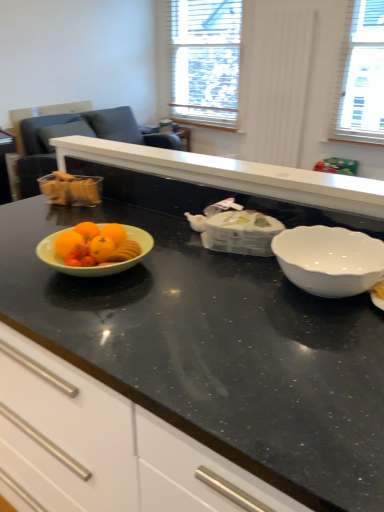
Question: From a real-world perspective, is translucent plastic container at left positioned under black granite countertop at center based on gravity?

Choices:
 (A) yes
 (B) no

Answer: (B)

Question: Can you confirm if translucent plastic container at left is wider than black granite countertop at center?

Choices:
 (A) yes
 (B) no

Answer: (B)

Question: Could you tell me if translucent plastic container at left is facing black granite countertop at center?

Choices:
 (A) no
 (B) yes

Answer: (B)

Question: Does translucent plastic container at left appear on the left side of black granite countertop at center?

Choices:
 (A) yes
 (B) no

Answer: (A)

Question: Are translucent plastic container at left and black granite countertop at center located far from each other?

Choices:
 (A) yes
 (B) no

Answer: (B)

Question: From the image's perspective, is translucent plastic container at left located beneath black granite countertop at center?

Choices:
 (A) yes
 (B) no

Answer: (B)

Question: Considering the relative sizes of matte gray armchair at left and white glossy bowl at right in the image provided, is matte gray armchair at left smaller than white glossy bowl at right?

Choices:
 (A) yes
 (B) no

Answer: (B)

Question: Is there a large distance between matte gray armchair at left and white glossy bowl at right?

Choices:
 (A) yes
 (B) no

Answer: (A)

Question: Does matte gray armchair at left have a lesser width compared to white glossy bowl at right?

Choices:
 (A) yes
 (B) no

Answer: (B)

Question: Is matte gray armchair at left further to camera compared to white glossy bowl at right?

Choices:
 (A) no
 (B) yes

Answer: (B)

Question: Is white glossy bowl at right at the back of matte gray armchair at left?

Choices:
 (A) no
 (B) yes

Answer: (A)

Question: Does matte gray armchair at left have a larger size compared to white glossy bowl at right?

Choices:
 (A) yes
 (B) no

Answer: (A)

Question: Is white glossy bowl at right facing towards translucent plastic container at left?

Choices:
 (A) yes
 (B) no

Answer: (B)